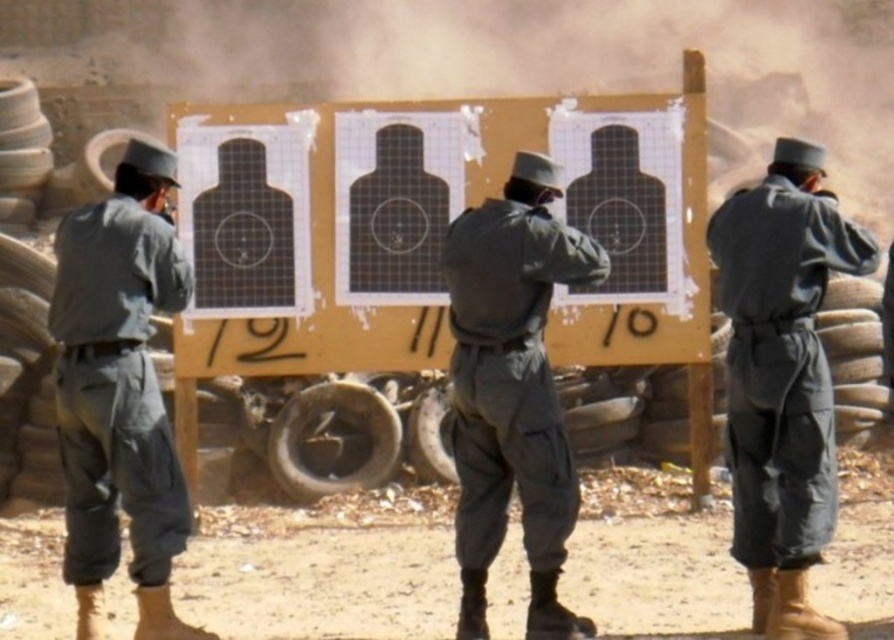
You are a photographer positioned at the origin point of the shooting range. You want to capture a closeup shot of the matte gray uniform at center. What are the coordinates where you should aim your camera?

The coordinates to aim your camera are at point (782, 378) to capture the matte gray uniform at center.

You are an observer at the shooting range. You notice a point marked at coordinates (782, 378). What object is located at that point?

The point at coordinates (782, 378) marks the matte gray uniform at center.